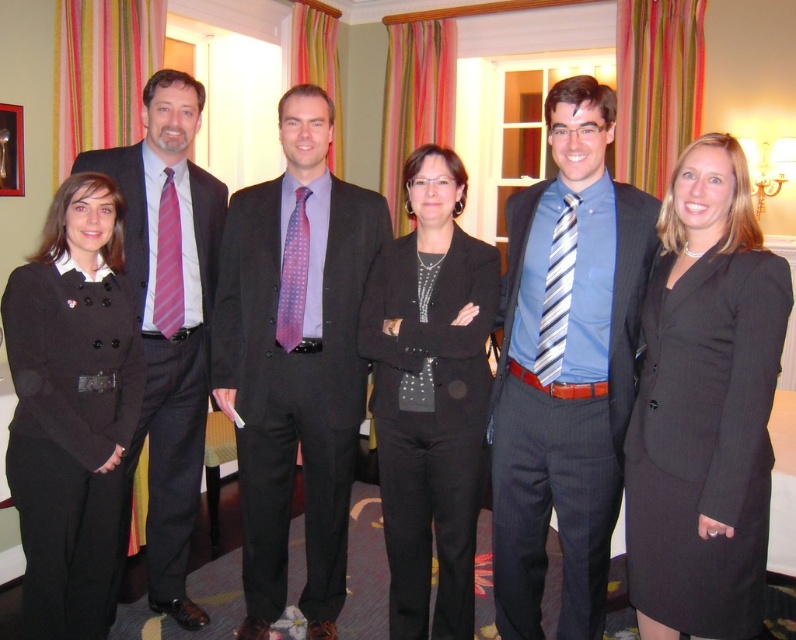
Which is behind, point (311, 584) or point (92, 404)?

Positioned behind is point (311, 584).

Between matte purple tie at center and matte black blazer at left, which one appears on the right side from the viewer's perspective?

From the viewer's perspective, matte purple tie at center appears more on the right side.

Is point (283, 204) more distant than point (131, 314)?

That is True.

Where is `matte purple tie at center`? matte purple tie at center is located at coordinates (295, 360).

Can you confirm if dark gray pinstripe suit at right is positioned above pink satin tie at left?

Incorrect, dark gray pinstripe suit at right is not positioned above pink satin tie at left.

Find the location of a particular element. Image resolution: width=796 pixels, height=640 pixels. dark gray pinstripe suit at right is located at coordinates (704, 406).

Is the position of blue striped tie at center less distant than that of matte purple tie at center?

That is True.

Can you confirm if blue striped tie at center is taller than matte purple tie at center?

No.

Is point (512, 268) positioned before point (291, 400)?

Yes, point (512, 268) is closer to viewer.

This screenshot has width=796, height=640. What are the coordinates of `blue striped tie at center` in the screenshot? It's located at (564, 368).